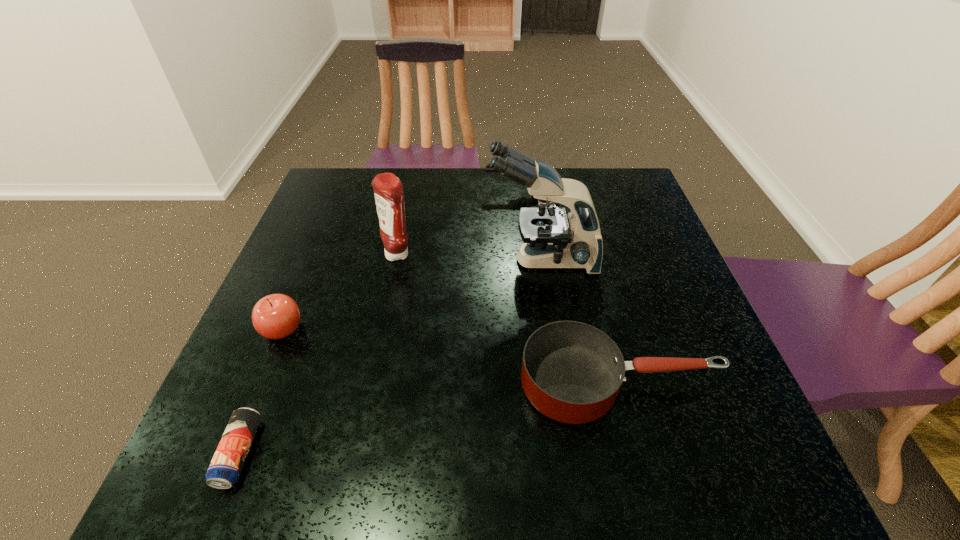
This screenshot has height=540, width=960. What are the coordinates of `the tallest object` in the screenshot? It's located at (551, 239).

You are a GUI agent. You are given a task and a screenshot of the screen. Output one action in this format:
    pyautogui.click(x=<x>, y=<y>)
    Task: Click on the third object from left to right
    The image size is (960, 540).
    Given the screenshot: What is the action you would take?
    pyautogui.click(x=388, y=190)

Image resolution: width=960 pixels, height=540 pixels. I want to click on condiment, so click(x=388, y=190).

Identify the location of apple. (276, 316).

Image resolution: width=960 pixels, height=540 pixels. In order to click on gun in this screenshot , I will do `click(488, 169)`.

At what (x,y) coordinates should I click in order to perform the action: click on pan. Please return your answer as a coordinate pair (x, y). The width and height of the screenshot is (960, 540). Looking at the image, I should click on (571, 372).

You are a GUI agent. You are given a task and a screenshot of the screen. Output one action in this format:
    pyautogui.click(x=<x>, y=<y>)
    Task: Click on the shortest object
    The height and width of the screenshot is (540, 960).
    Given the screenshot: What is the action you would take?
    pyautogui.click(x=224, y=470)

Identify the location of free space located through the eyepieces of the tallest object. The height and width of the screenshot is (540, 960). (339, 260).

Find the location of a particular element. The width and height of the screenshot is (960, 540). vacant space located 0.320m through the eyepieces of the tallest object is located at coordinates (359, 260).

I want to click on free region located 0.260m through the eyepieces of the tallest object, so click(x=383, y=260).